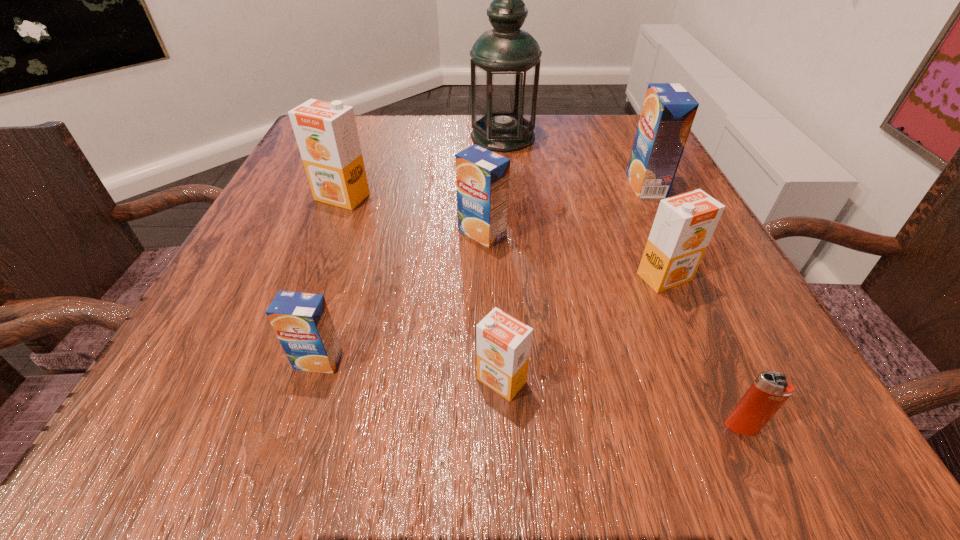
Locate an element on the screen. This screenshot has width=960, height=540. vacant area that lies between the green oil lamp and the nearest object is located at coordinates (622, 282).

Identify the location of unoccupied position between the nearest object and the second farthest blue orange_juice. (612, 330).

Where is `free spot between the second blue orange_juice from left to right and the farthest blue orange_juice`? free spot between the second blue orange_juice from left to right and the farthest blue orange_juice is located at coordinates (564, 210).

Point out which object is positioned as the nearest to the farthest blue orange_juice. Please provide its 2D coordinates. Your answer should be formatted as a tuple, i.e. [(x, y)], where the tuple contains the x and y coordinates of a point satisfying the conditions above.

[(684, 224)]

Identify which object is the seventh closest to the farthest object. Please provide its 2D coordinates. Your answer should be formatted as a tuple, i.e. [(x, y)], where the tuple contains the x and y coordinates of a point satisfying the conditions above.

[(770, 390)]

Find the location of a particular element. The width and height of the screenshot is (960, 540). the second closest orange juice to the rightmost orange orange juice is located at coordinates (482, 176).

You are a GUI agent. You are given a task and a screenshot of the screen. Output one action in this format:
    pyautogui.click(x=<x>, y=<y>)
    Task: Click on the orange juice object that ranks as the closest to the leftmost orange orange juice
    The image size is (960, 540).
    Given the screenshot: What is the action you would take?
    pyautogui.click(x=482, y=176)

Identify which orange orange juice is the second closest to the biggest blue orange_juice. Please provide its 2D coordinates. Your answer should be formatted as a tuple, i.e. [(x, y)], where the tuple contains the x and y coordinates of a point satisfying the conditions above.

[(503, 343)]

You are a GUI agent. You are given a task and a screenshot of the screen. Output one action in this format:
    pyautogui.click(x=<x>, y=<y>)
    Task: Click on the orange orange juice that is the second closest one to the farthest blue orange_juice
    This screenshot has height=540, width=960.
    Given the screenshot: What is the action you would take?
    pyautogui.click(x=503, y=343)

Where is `blue orange_juice that stands as the closest to the rightmost blue orange_juice`? The width and height of the screenshot is (960, 540). blue orange_juice that stands as the closest to the rightmost blue orange_juice is located at coordinates (482, 176).